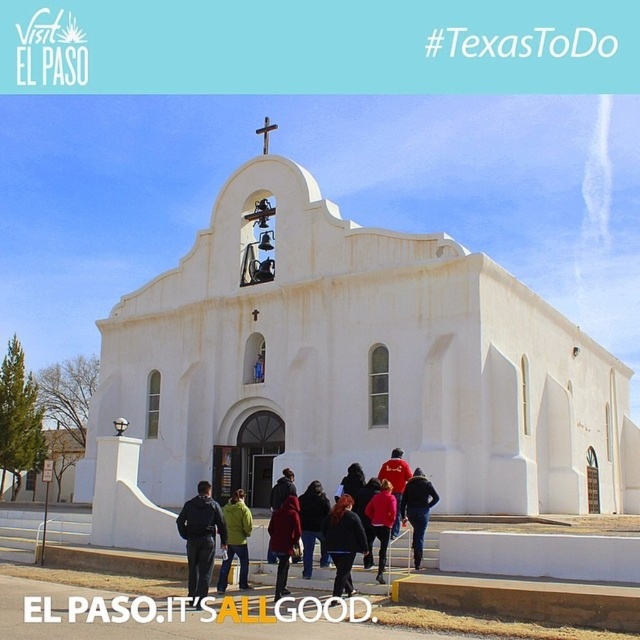
Which is in front, point (506, 499) or point (387, 541)?

Positioned in front is point (387, 541).

Which of these two, white stucco chapel at center or red matte jacket at center, stands shorter?

red matte jacket at center

Does point (218, 410) come farther from viewer compared to point (376, 512)?

Yes, point (218, 410) is behind point (376, 512).

Locate an element on the screen. The image size is (640, 640). white stucco chapel at center is located at coordinates (353, 368).

Who is taller, white stucco chapel at center or green matte jacket at center?

white stucco chapel at center is taller.

Can you confirm if white stucco chapel at center is smaller than green matte jacket at center?

Actually, white stucco chapel at center might be larger than green matte jacket at center.

Does point (532, 394) lie behind point (241, 500)?

Yes, it is behind point (241, 500).

Locate an element on the screen. The image size is (640, 640). white stucco chapel at center is located at coordinates (353, 368).

Does black fabric jacket at center have a lesser height compared to red jacket at center?

No.

Does black fabric jacket at center lie in front of red jacket at center?

Yes.

The width and height of the screenshot is (640, 640). In order to click on black fabric jacket at center in this screenshot , I will do `click(200, 538)`.

Where is `black fabric jacket at center`? black fabric jacket at center is located at coordinates point(200,538).